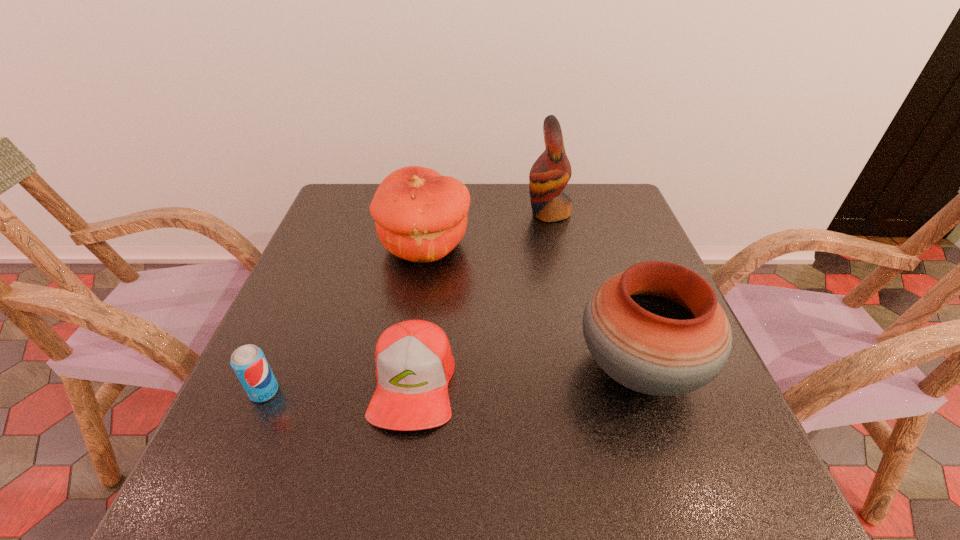
Where is `vacant space that satisfies the following two spatial constraints: 1. on the face of the parrot; 2. on the front-facing side of the baseball cap`? vacant space that satisfies the following two spatial constraints: 1. on the face of the parrot; 2. on the front-facing side of the baseball cap is located at coordinates (585, 383).

Image resolution: width=960 pixels, height=540 pixels. I want to click on free space that satisfies the following two spatial constraints: 1. on the back side of the pottery; 2. on the left side of the leftmost object, so click(275, 368).

Find the location of a particular element. The image size is (960, 540). vacant position in the image that satisfies the following two spatial constraints: 1. on the face of the parrot; 2. on the front-facing side of the baseball cap is located at coordinates (585, 383).

The image size is (960, 540). I want to click on vacant space that satisfies the following two spatial constraints: 1. on the front side of the pumpkin; 2. on the right side of the pottery, so click(x=407, y=368).